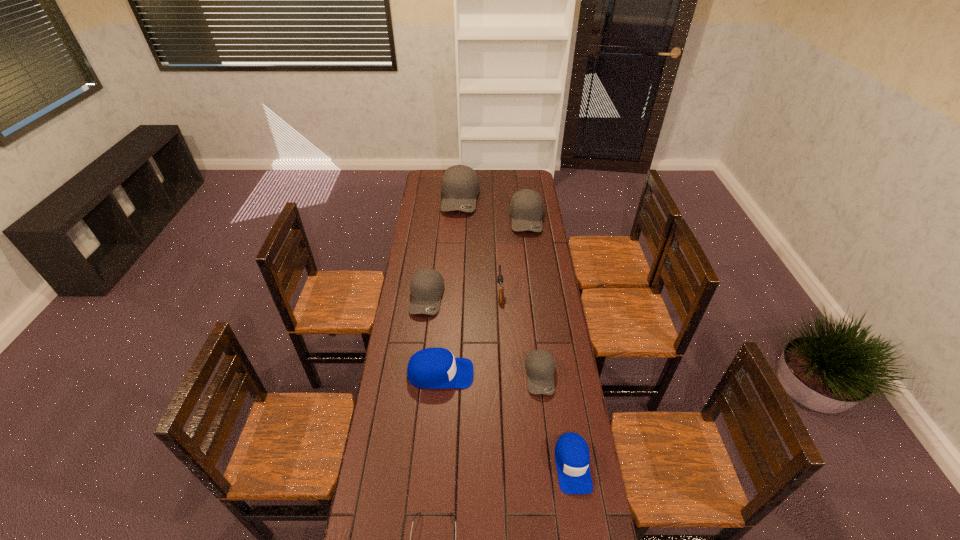
Find the location of a particular element. This screenshot has height=540, width=960. the nearest gray baseball cap is located at coordinates (540, 364).

You are a GUI agent. You are given a task and a screenshot of the screen. Output one action in this format:
    pyautogui.click(x=<x>, y=<y>)
    Task: Click on the nearest baseball cap
    Image resolution: width=960 pixels, height=540 pixels.
    Given the screenshot: What is the action you would take?
    pyautogui.click(x=572, y=457)

The image size is (960, 540). What are the coordinates of `the nearer blue baseball cap` in the screenshot? It's located at (572, 457).

At what (x,y) coordinates should I click in order to perform the action: click on free space located on the front brim of the biggest gray baseball cap. Please return your answer as a coordinate pair (x, y). The height and width of the screenshot is (540, 960). Looking at the image, I should click on 457,259.

Locate an element on the screen. free space located 0.090m on the front brim of the second tallest object is located at coordinates (531, 247).

Find the location of a particular element. This screenshot has width=960, height=540. free space located on the front brim of the fourth nearest baseball cap is located at coordinates (420, 351).

At what (x,y) coordinates should I click in order to perform the action: click on free space located along the barrel of the black gun. Please return your answer as a coordinate pair (x, y). The image size is (960, 540). Looking at the image, I should click on (497, 237).

The width and height of the screenshot is (960, 540). In order to click on blank area located 0.100m along the barrel of the black gun in this screenshot , I will do `click(498, 266)`.

Image resolution: width=960 pixels, height=540 pixels. In order to click on vacant space located 0.120m along the barrel of the black gun in this screenshot , I will do `click(498, 264)`.

Locate an element on the screen. This screenshot has width=960, height=540. free region located on the front-facing side of the bigger blue baseball cap is located at coordinates (541, 374).